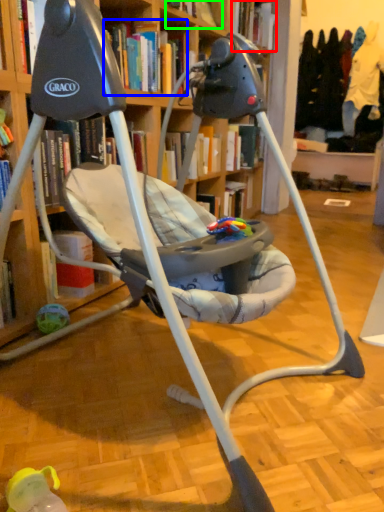
Question: Considering the real-world distances, which object is farthest from book (highlighted by a red box)? book (highlighted by a blue box) or book (highlighted by a green box)?

Choices:
 (A) book
 (B) book

Answer: (A)